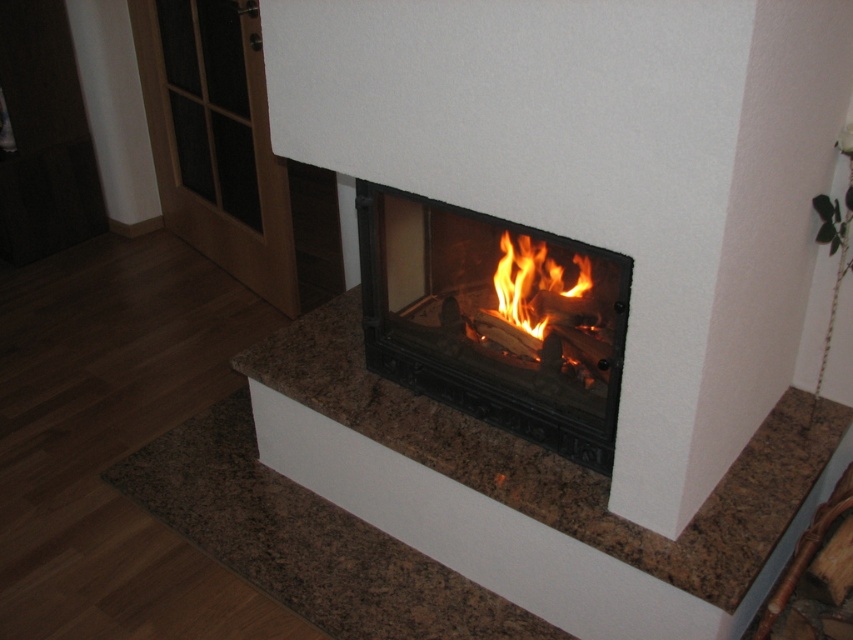
Is black glass fireplace at center positioned at the back of flamewoodfire at center?

No, it is in front of flamewoodfire at center.

Between point (587, 314) and point (521, 308), which one is positioned behind?

Point (521, 308)

The image size is (853, 640). What do you see at coordinates (494, 317) in the screenshot? I see `black glass fireplace at center` at bounding box center [494, 317].

At what (x,y) coordinates should I click in order to perform the action: click on black glass fireplace at center. Please return your answer as a coordinate pair (x, y). The width and height of the screenshot is (853, 640). Looking at the image, I should click on (494, 317).

Does brown granite fireplace at center appear on the right side of flamewoodfire at center?

No, brown granite fireplace at center is not to the right of flamewoodfire at center.

This screenshot has width=853, height=640. Describe the element at coordinates (527, 492) in the screenshot. I see `brown granite fireplace at center` at that location.

Locate an element on the screen. This screenshot has width=853, height=640. brown granite fireplace at center is located at coordinates (527, 492).

Describe the element at coordinates (527, 492) in the screenshot. I see `brown granite fireplace at center` at that location.

Is the position of brown granite fireplace at center more distant than that of black glass fireplace at center?

Yes, brown granite fireplace at center is further from the viewer.

Describe the element at coordinates (527, 492) in the screenshot. I see `brown granite fireplace at center` at that location.

Identify the location of brown granite fireplace at center. Image resolution: width=853 pixels, height=640 pixels. (527, 492).